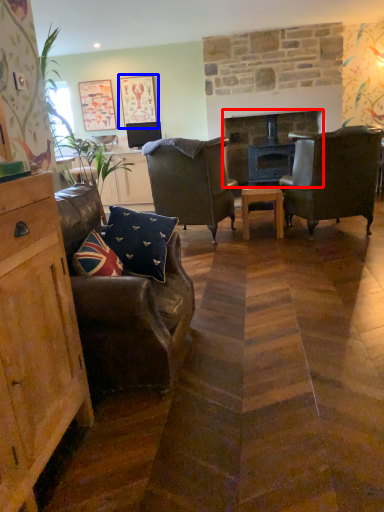
Question: Which object is closer to the camera taking this photo, fireplace (highlighted by a red box) or picture frame (highlighted by a blue box)?

Choices:
 (A) fireplace
 (B) picture frame

Answer: (A)